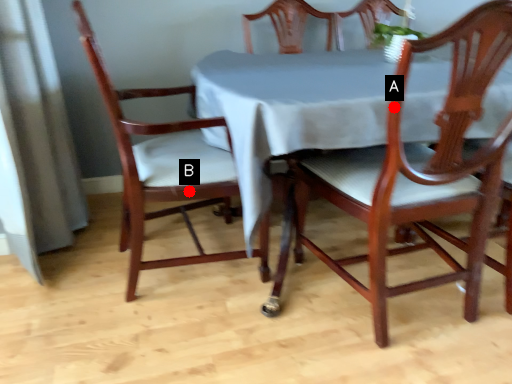
Question: Two points are circled on the image, labeled by A and B beside each circle. Among these points, which one is nearest to the camera?

Choices:
 (A) A is closer
 (B) B is closer

Answer: (A)